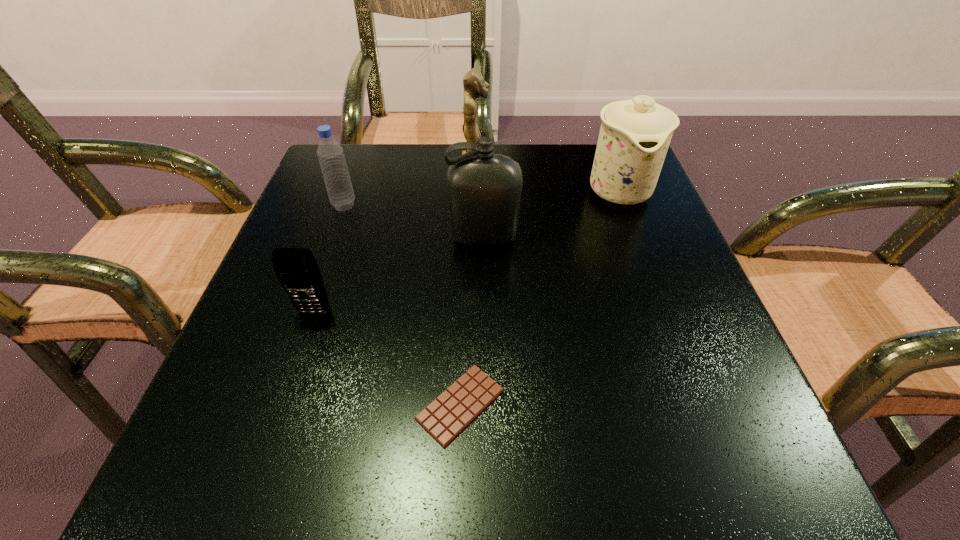
This screenshot has height=540, width=960. In order to click on vacant space located on the front-facing side of the figurine in this screenshot , I will do `click(514, 168)`.

Locate an element on the screen. This screenshot has height=540, width=960. blank space located 0.080m on the spout of the chinaware is located at coordinates (639, 248).

I want to click on vacant space situated 0.270m on the front of the right bottle, so click(x=485, y=381).

Image resolution: width=960 pixels, height=540 pixels. Identify the location of vacant space located on the right of the shorter bottle. (542, 205).

This screenshot has height=540, width=960. Find the location of `free space located 0.110m on the screen of the second shortest object`. free space located 0.110m on the screen of the second shortest object is located at coordinates (292, 378).

This screenshot has height=540, width=960. I want to click on vacant space located 0.100m on the back of the shortest object, so click(x=464, y=314).

Where is `figurine situated at the far edge`? Image resolution: width=960 pixels, height=540 pixels. figurine situated at the far edge is located at coordinates (474, 85).

This screenshot has height=540, width=960. I want to click on chinaware at the far edge, so click(x=635, y=134).

Where is `bottle that is at the far edge`? This screenshot has width=960, height=540. bottle that is at the far edge is located at coordinates (331, 157).

Find the location of `object that is at the near edge`. object that is at the near edge is located at coordinates (450, 413).